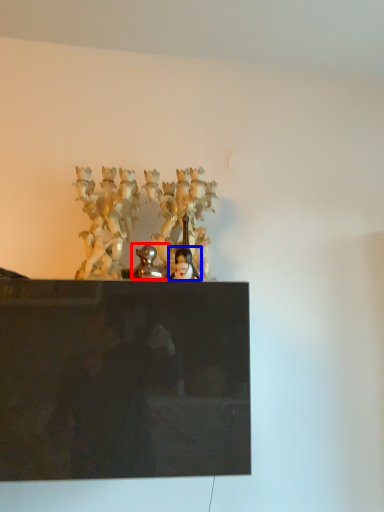
Question: Which object appears closest to the camera in this image, sculpture (highlighted by a red box) or person (highlighted by a blue box)?

Choices:
 (A) sculpture
 (B) person

Answer: (A)